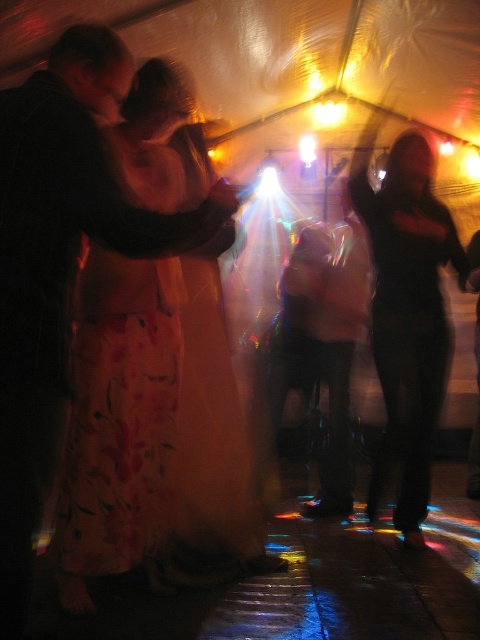
You are standing inside the tent at the lively gathering. You see two points marked in the image. The first point is at coordinates point (160, 278) and the second is at point (445, 342). Which point is nearer to you?

Point (160, 278) is closer to the camera than point (445, 342), so the first point is nearer to you.

You are standing at the entrance of the tent and want to locate the matte black jacket at left. Which direction should you look to find it?

The matte black jacket at left is located at point 0.409 on the x axis and 0.125 on the y axis, so you should look to your left side since it has an x coordinate of 0.409 which is to the left of the center.

You are a photographer at the event and want to capture a clear photo of both the matte black jacket at left and the floral silk dress at center. Since the subjects are moving, you need to adjust your camera settings. Considering their positions, which subject should you focus on first to ensure both are in focus?

The matte black jacket at left is located above the floral silk dress at center. To ensure both are in focus, you should focus on the matte black jacket at left first since it is closer to the camera, allowing the depth of field to cover the lower positioned floral silk dress at center.